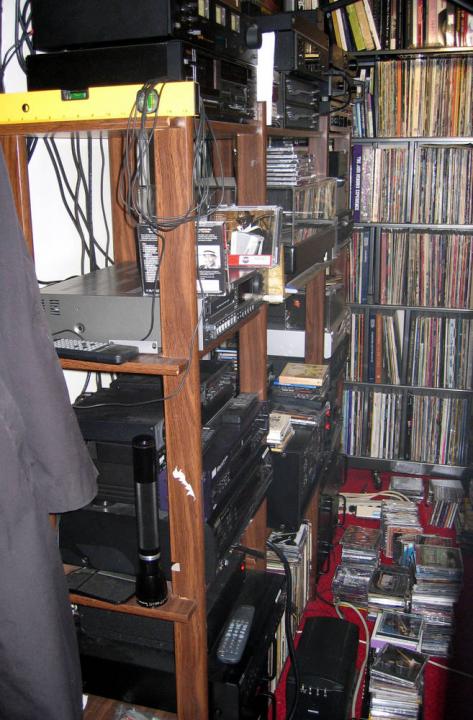
The image size is (473, 720). Find the location of `coat`. coat is located at coordinates (26, 468).